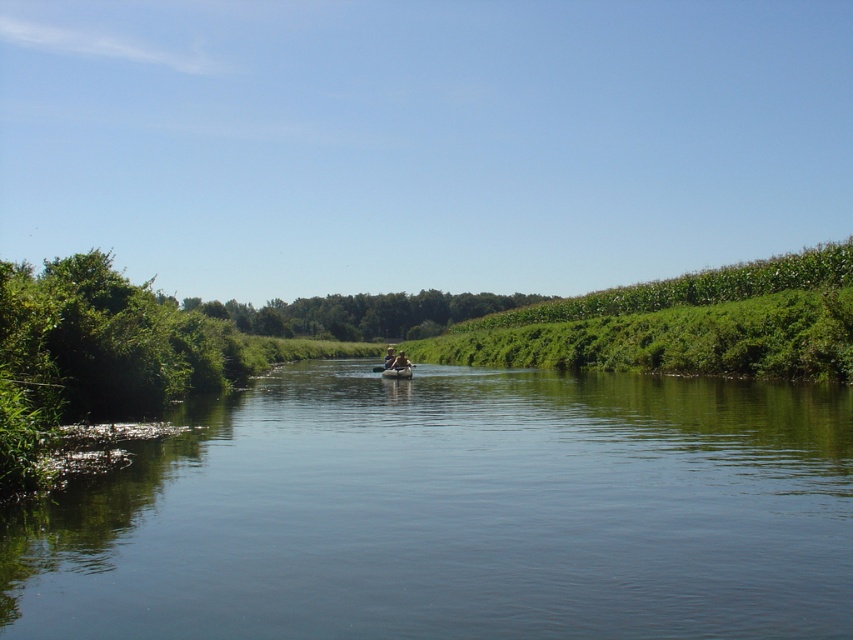
Question: Can you confirm if green smooth water at center is positioned above rubber boat at center?

Choices:
 (A) yes
 (B) no

Answer: (B)

Question: Does green smooth water at center appear on the left side of light brown wooden paddle boat at center?

Choices:
 (A) no
 (B) yes

Answer: (A)

Question: Based on their relative distances, which object is nearer to the smooth tan kayak at center?

Choices:
 (A) rubber boat at center
 (B) green smooth water at center
 (C) green leafy trees at center

Answer: (A)

Question: Which point is closer to the camera taking this photo?

Choices:
 (A) (387, 368)
 (B) (322, 452)

Answer: (B)

Question: Among these points, which one is nearest to the camera?

Choices:
 (A) pos(608,529)
 (B) pos(428,296)
 (C) pos(387,362)

Answer: (A)

Question: Does smooth tan kayak at center appear under light brown wooden paddle boat at center?

Choices:
 (A) no
 (B) yes

Answer: (A)